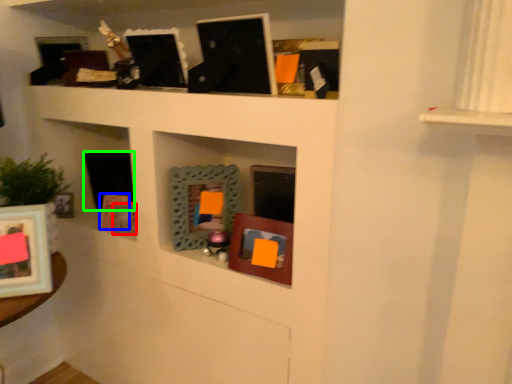
Question: Which object is the farthest from picture frame (highlighted by a red box)? Choose among these: picture frame (highlighted by a blue box) or picture frame (highlighted by a green box).

Choices:
 (A) picture frame
 (B) picture frame

Answer: (B)